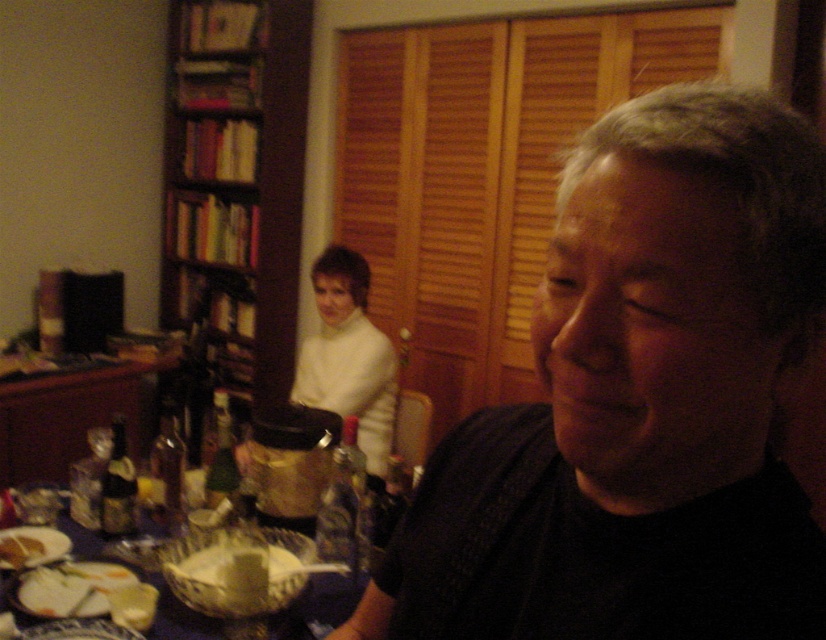
You are a photographer trying to capture a closeup of the white creamy bread at lower left. However, the black matte shirt at center is blocking your view. Can you adjust your position to take the photo without moving any objects?

The black matte shirt at center is in front of the white creamy bread at lower left, so you can move your camera position to the left side to avoid the obstruction caused by the black matte shirt at center and capture the white creamy bread at lower left.

From the picture: You are a photographer adjusting your camera to focus on the black matte shirt at center and the white creamy bread at lower left. Which object should you focus on first if you want to capture both in sharp detail?

The black matte shirt at center should be focused on first because it is much taller than the white creamy bread at lower left, so focusing on the farther object first would help ensure both are in focus when adjusting the depth of field.